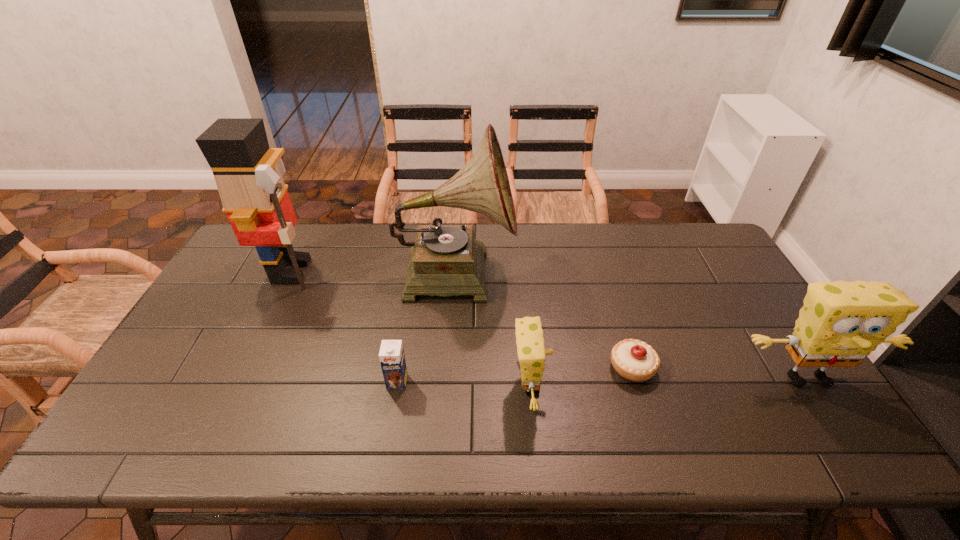
Considering the uniform spacing of sponges, where should an additional sponge be positioned on the left? Please locate a free spot. Please provide its 2D coordinates. Your answer should be formatted as a tuple, i.e. [(x, y)], where the tuple contains the x and y coordinates of a point satisfying the conditions above.

[(244, 394)]